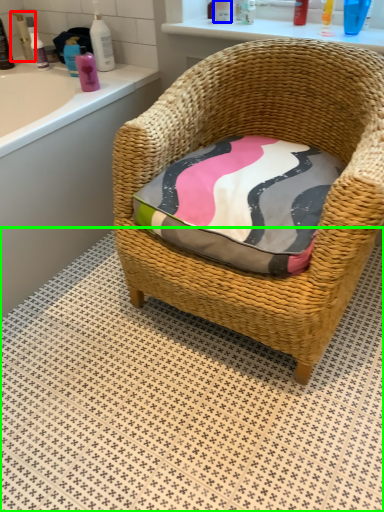
Question: Estimate the real-world distances between objects in this image. Which object is closer to toiletry (highlighted by a red box), toiletry (highlighted by a blue box) or tile (highlighted by a green box)?

Choices:
 (A) toiletry
 (B) tile

Answer: (A)